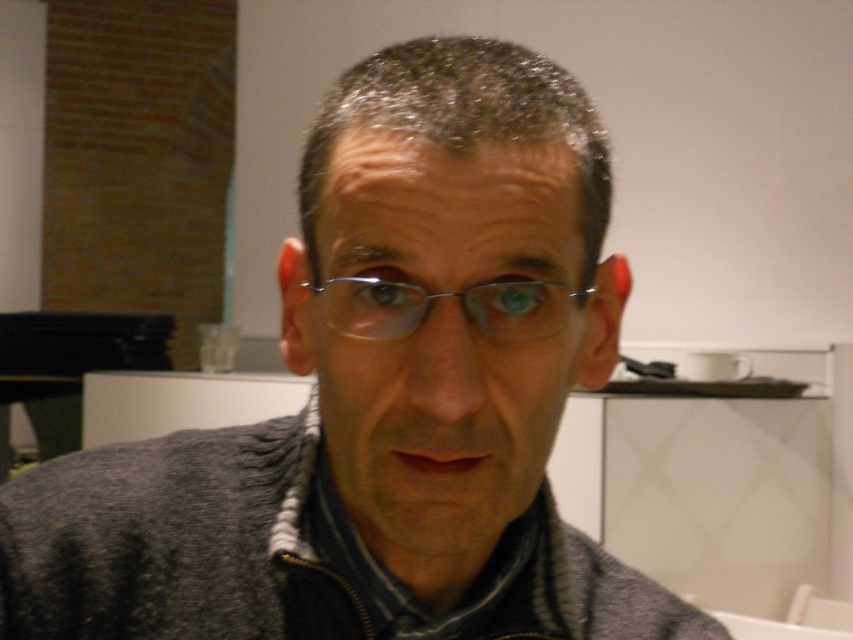
Between matte gray sweater at center and metallic frame glasses at center, which one has more height?

Standing taller between the two is matte gray sweater at center.

The height and width of the screenshot is (640, 853). Identify the location of matte gray sweater at center. (450, 337).

The width and height of the screenshot is (853, 640). What do you see at coordinates (450, 337) in the screenshot?
I see `matte gray sweater at center` at bounding box center [450, 337].

The width and height of the screenshot is (853, 640). Identify the location of matte gray sweater at center. (450, 337).